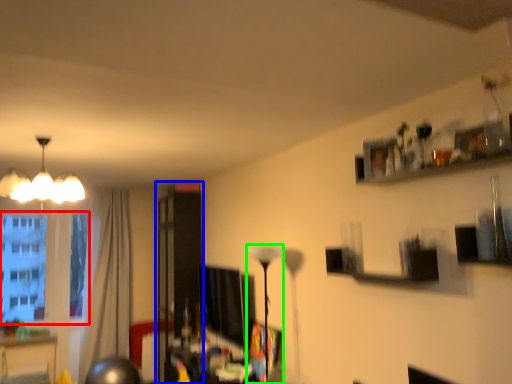
Question: Considering the real-world distances, which object is closest to window screen (highlighted by a red box)? glass door (highlighted by a blue box) or lamp (highlighted by a green box).

Choices:
 (A) glass door
 (B) lamp

Answer: (A)